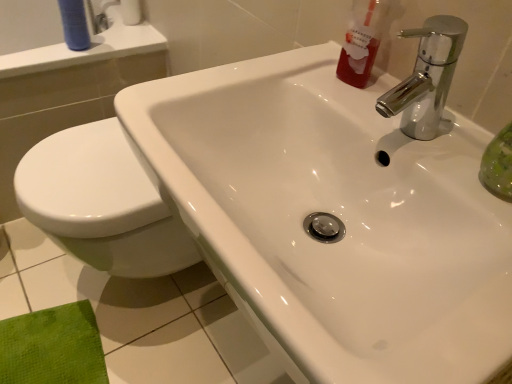
This screenshot has width=512, height=384. Identify the location of spots to the right of blue matte tube at upper left. (120, 46).